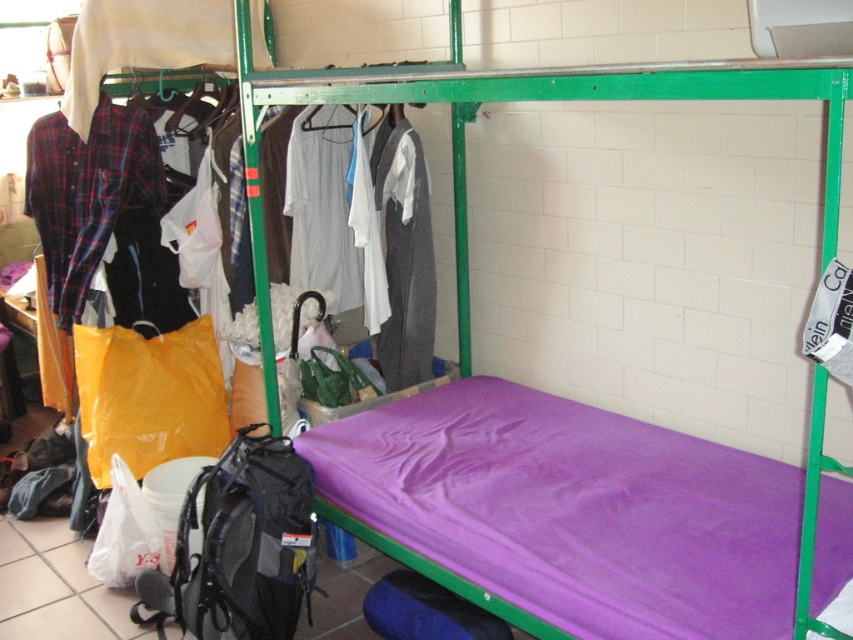
Question: Which object appears farthest from the camera in this image?

Choices:
 (A) plaid cotton shirt at left
 (B) white striped shirt at center
 (C) purple fabric mattress at lower center
 (D) dark gray wool sweater at center

Answer: (A)

Question: Which of the following is the farthest from the observer?

Choices:
 (A) (38, 160)
 (B) (344, 275)
 (C) (402, 129)

Answer: (B)

Question: Can you confirm if purple fabric mattress at lower center is positioned above white striped shirt at center?

Choices:
 (A) yes
 (B) no

Answer: (B)

Question: Is plaid cotton shirt at left wider than dark gray wool sweater at center?

Choices:
 (A) yes
 (B) no

Answer: (A)

Question: Which of the following is the farthest from the observer?

Choices:
 (A) (384, 163)
 (B) (68, 236)
 (C) (300, 168)

Answer: (B)

Question: Does dark gray wool sweater at center appear on the right side of white striped shirt at center?

Choices:
 (A) no
 (B) yes

Answer: (B)